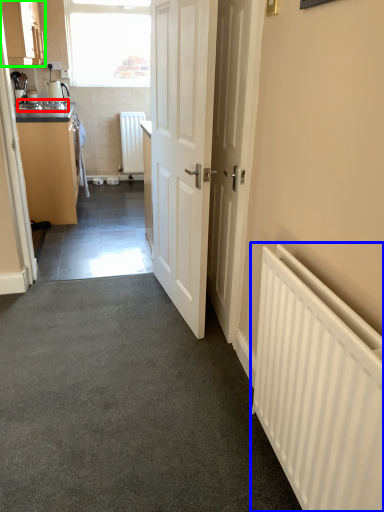
Question: Which object is the closest to the sink (highlighted by a red box)? Choose among these: radiator (highlighted by a blue box) or cabinetry (highlighted by a green box).

Choices:
 (A) radiator
 (B) cabinetry

Answer: (B)